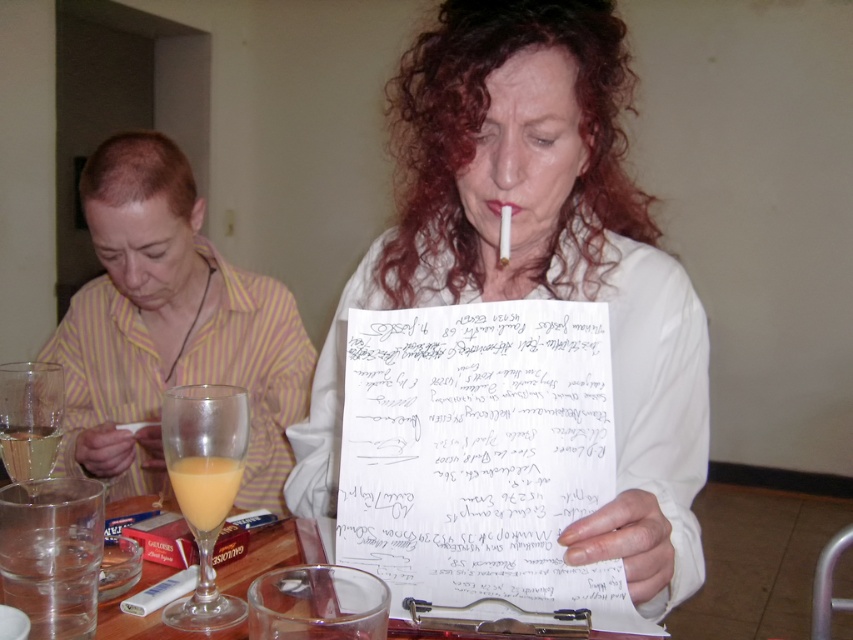
Can you confirm if yellow striped shirt at left is positioned above clear glass at center?

Correct, yellow striped shirt at left is located above clear glass at center.

Does point (160, 140) come closer to viewer compared to point (293, 550)?

No, it is behind (293, 550).

At what (x,y) coordinates should I click in order to perform the action: click on yellow striped shirt at left. Please return your answer as a coordinate pair (x, y). Looking at the image, I should click on (170, 326).

Can you confirm if white paper at center is taller than translucent glass at lower center?

Indeed, white paper at center has a greater height compared to translucent glass at lower center.

Who is lower down, white paper at center or translucent glass at lower center?

Positioned lower is translucent glass at lower center.

Image resolution: width=853 pixels, height=640 pixels. Describe the element at coordinates (538, 257) in the screenshot. I see `white paper at center` at that location.

At what (x,y) coordinates should I click in order to perform the action: click on white paper at center. Please return your answer as a coordinate pair (x, y). Looking at the image, I should click on pyautogui.click(x=538, y=257).

Is point (209, 492) positioned after point (9, 472)?

No.

Is translucent glass at lower center closer to camera compared to translucent glass at lower left?

Yes, it is in front of translucent glass at lower left.

Who is more distant from viewer, (190,458) or (15,451)?

Positioned behind is point (15,451).

Image resolution: width=853 pixels, height=640 pixels. I want to click on translucent glass at lower center, so click(204, 490).